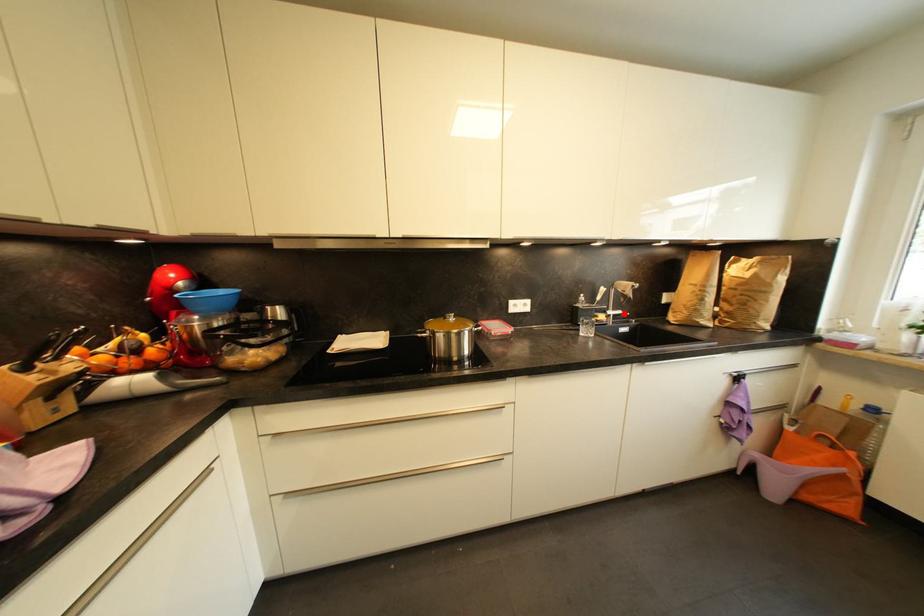
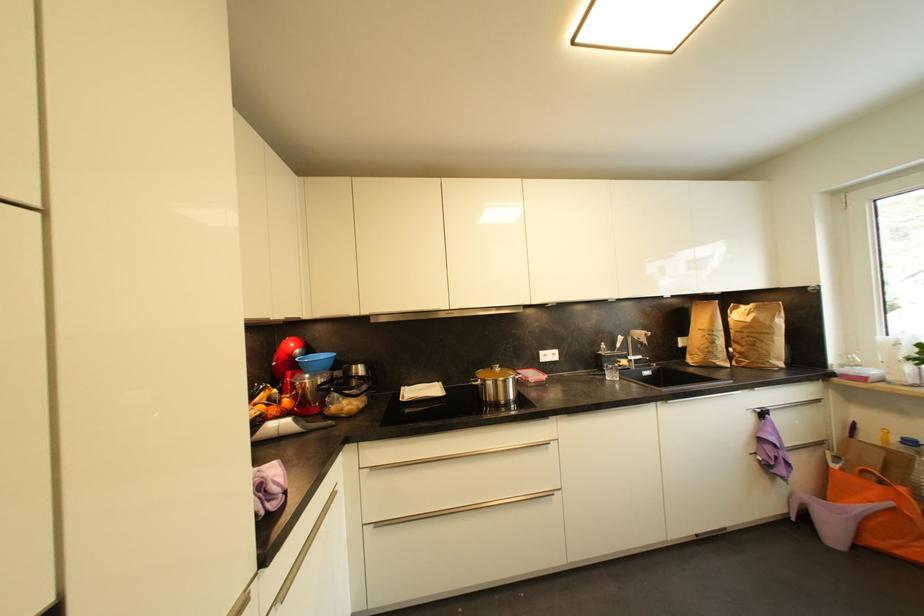
The point at the highlighted location is marked in the first image. Where is the corresponding point in the second image?

(645, 359)